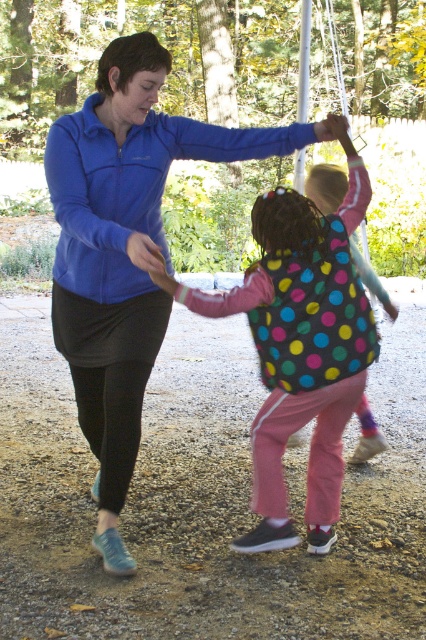
Question: Among these points, which one is farthest from the camera?

Choices:
 (A) (293, 276)
 (B) (161, 80)

Answer: (A)

Question: Does blue fleece jacket at center have a larger size compared to polka dot fabric jacket at center?

Choices:
 (A) yes
 (B) no

Answer: (A)

Question: Is blue fleece jacket at center closer to the viewer compared to polka dot fabric jacket at center?

Choices:
 (A) no
 (B) yes

Answer: (B)

Question: Is the position of blue fleece jacket at center less distant than that of polka dot fabric jacket at center?

Choices:
 (A) no
 (B) yes

Answer: (B)

Question: Which of the following is the farthest from the observer?

Choices:
 (A) (261, 301)
 (B) (143, 228)

Answer: (B)